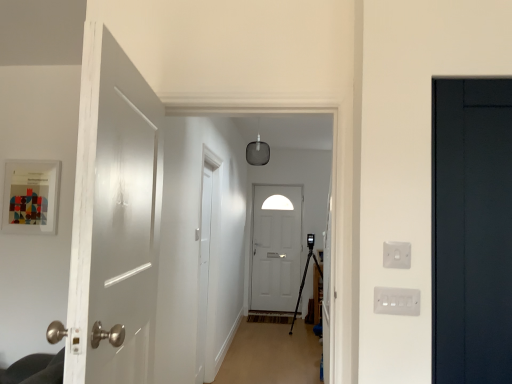
Question: Considering the relative positions of white plastic switch at right, arranged as the 1th electric outlet when ordered from the bottom, and white matte door at center, acting as the first door starting from the back, in the image provided, is white plastic switch at right, arranged as the 1th electric outlet when ordered from the bottom, to the left of white matte door at center, acting as the first door starting from the back, from the viewer's perspective?

Choices:
 (A) no
 (B) yes

Answer: (A)

Question: Considering the relative positions of white plastic switch at right, arranged as the 1th electric outlet when ordered from the bottom, and white matte door at center, acting as the first door starting from the back, in the image provided, is white plastic switch at right, arranged as the 1th electric outlet when ordered from the bottom, to the right of white matte door at center, acting as the first door starting from the back, from the viewer's perspective?

Choices:
 (A) yes
 (B) no

Answer: (A)

Question: From the image's perspective, would you say white plastic switch at right, arranged as the 1th electric outlet when ordered from the bottom, is positioned over white matte door at center, which appears as the 2th door when viewed from the right?

Choices:
 (A) yes
 (B) no

Answer: (A)

Question: From a real-world perspective, is white plastic switch at right, which is the 2th electric outlet from top to bottom, located higher than white matte door at center, which appears as the 2th door when viewed from the right?

Choices:
 (A) yes
 (B) no

Answer: (A)

Question: Is white plastic switch at right, which is the 2th electric outlet from top to bottom, aimed at white matte door at center, acting as the first door starting from the back?

Choices:
 (A) yes
 (B) no

Answer: (B)

Question: Is white plastic switch at right, which is the 2th electric outlet from top to bottom, not inside white matte door at center, which appears as the second door when viewed from the left?

Choices:
 (A) yes
 (B) no

Answer: (A)

Question: Does white glossy door at left, the 3th door viewed from the right, appear on the right side of white matte door at center, which appears as the 2th door when viewed from the right?

Choices:
 (A) yes
 (B) no

Answer: (B)

Question: Considering the relative positions of white glossy door at left, which appears as the 1th door when viewed from the front, and white matte door at center, which appears as the second door when viewed from the left, in the image provided, is white glossy door at left, which appears as the 1th door when viewed from the front, to the left of white matte door at center, which appears as the second door when viewed from the left, from the viewer's perspective?

Choices:
 (A) no
 (B) yes

Answer: (B)

Question: Is white glossy door at left, which appears as the 1th door when viewed from the front, aimed at white matte door at center, which appears as the 2th door when viewed from the right?

Choices:
 (A) no
 (B) yes

Answer: (A)

Question: Considering the relative sizes of white glossy door at left, which appears as the 1th door when viewed from the front, and white matte door at center, acting as the first door starting from the back, in the image provided, is white glossy door at left, which appears as the 1th door when viewed from the front, taller than white matte door at center, acting as the first door starting from the back,?

Choices:
 (A) no
 (B) yes

Answer: (A)

Question: Is white glossy door at left, the first door when ordered from left to right, placed right next to white matte door at center, the 3th door from the front?

Choices:
 (A) yes
 (B) no

Answer: (B)

Question: Considering the relative sizes of white glossy door at left, the 3th door viewed from the back, and white matte door at center, which appears as the 2th door when viewed from the right, in the image provided, is white glossy door at left, the 3th door viewed from the back, smaller than white matte door at center, which appears as the 2th door when viewed from the right,?

Choices:
 (A) yes
 (B) no

Answer: (B)

Question: Can you confirm if white plastic electric outlet at right, positioned as the 1th electric outlet in top-to-bottom order, is bigger than wooden floor at center?

Choices:
 (A) no
 (B) yes

Answer: (A)